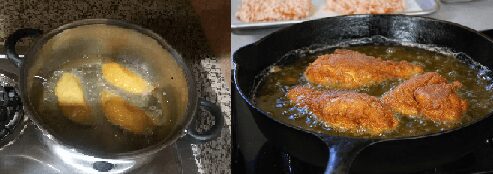
Where is `baking tray`? The height and width of the screenshot is (174, 493). baking tray is located at coordinates (433, 9).